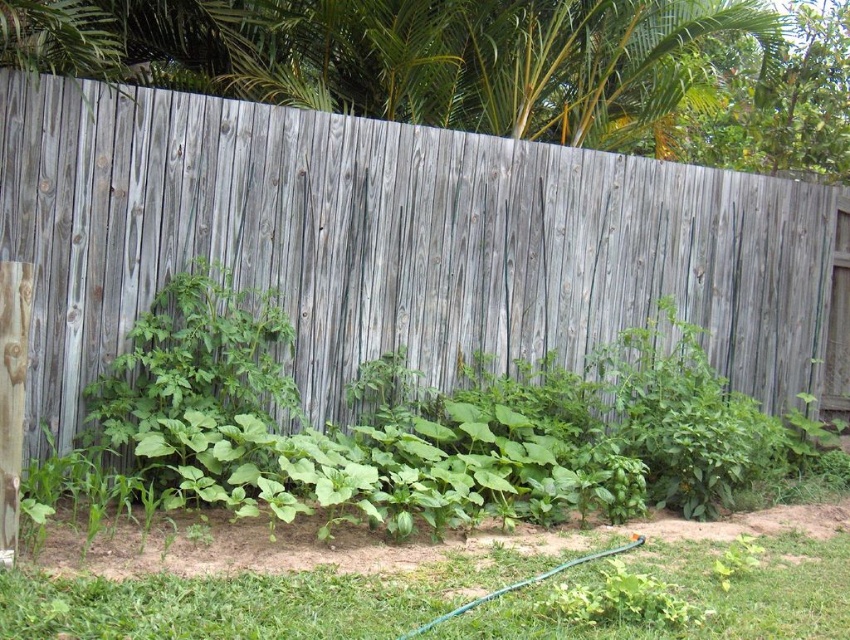
Question: Which object appears farthest from the camera in this image?

Choices:
 (A) green grass at lower center
 (B) green rubber hose at lower center

Answer: (B)

Question: Among these objects, which one is nearest to the camera?

Choices:
 (A) green rubber hose at lower center
 (B) weathered wood fence at center

Answer: (A)

Question: Is weathered wood fence at center closer to camera compared to green grass at lower center?

Choices:
 (A) no
 (B) yes

Answer: (A)

Question: Which point appears closest to the camera in this image?

Choices:
 (A) (806, 582)
 (B) (412, 353)

Answer: (A)

Question: Does weathered wood fence at center have a lesser width compared to green rubber hose at lower center?

Choices:
 (A) yes
 (B) no

Answer: (A)

Question: Is green grass at lower center positioned behind green rubber hose at lower center?

Choices:
 (A) no
 (B) yes

Answer: (A)